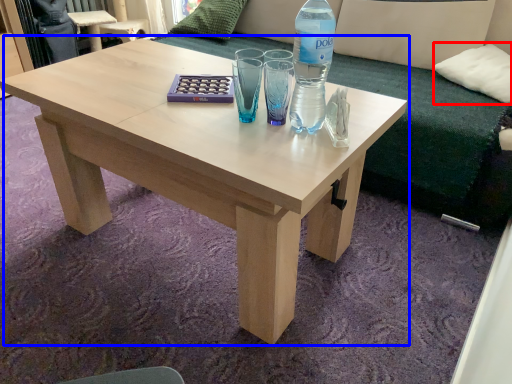
Question: Which object appears farthest to the camera in this image, pillow (highlighted by a red box) or coffee table (highlighted by a blue box)?

Choices:
 (A) pillow
 (B) coffee table

Answer: (A)